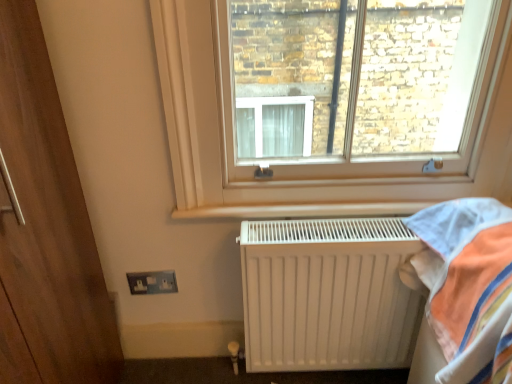
Question: Is metallic silver electrical outlet at lower left not within white plastic window at upper center?

Choices:
 (A) yes
 (B) no

Answer: (A)

Question: From a real-world perspective, is metallic silver electrical outlet at lower left physically below white plastic window at upper center?

Choices:
 (A) yes
 (B) no

Answer: (A)

Question: From a real-world perspective, is metallic silver electrical outlet at lower left located higher than white plastic window at upper center?

Choices:
 (A) no
 (B) yes

Answer: (A)

Question: Does metallic silver electrical outlet at lower left have a greater width compared to white plastic window at upper center?

Choices:
 (A) no
 (B) yes

Answer: (A)

Question: Would you consider metallic silver electrical outlet at lower left to be distant from white plastic window at upper center?

Choices:
 (A) yes
 (B) no

Answer: (B)

Question: Is white plastic window at upper center bigger or smaller than metallic silver electrical outlet at lower left?

Choices:
 (A) small
 (B) big

Answer: (B)

Question: Does point (450, 187) appear closer or farther from the camera than point (163, 271)?

Choices:
 (A) closer
 (B) farther

Answer: (A)

Question: Considering the positions of white plastic window at upper center and metallic silver electrical outlet at lower left in the image, is white plastic window at upper center taller or shorter than metallic silver electrical outlet at lower left?

Choices:
 (A) tall
 (B) short

Answer: (A)

Question: From the image's perspective, relative to metallic silver electrical outlet at lower left, is white plastic window at upper center above or below?

Choices:
 (A) above
 (B) below

Answer: (A)

Question: From the image's perspective, is white plastic window at upper center positioned above or below white matte radiator at lower right?

Choices:
 (A) above
 (B) below

Answer: (A)

Question: In terms of height, does white plastic window at upper center look taller or shorter compared to white matte radiator at lower right?

Choices:
 (A) short
 (B) tall

Answer: (B)

Question: Does point coord(155,46) appear closer or farther from the camera than point coord(351,329)?

Choices:
 (A) farther
 (B) closer

Answer: (B)

Question: From a real-world perspective, is white plastic window at upper center positioned above or below white matte radiator at lower right?

Choices:
 (A) above
 (B) below

Answer: (A)

Question: Is metallic silver electrical outlet at lower left bigger or smaller than white matte radiator at lower right?

Choices:
 (A) small
 (B) big

Answer: (A)

Question: Is point (168, 283) closer or farther from the camera than point (349, 221)?

Choices:
 (A) closer
 (B) farther

Answer: (B)